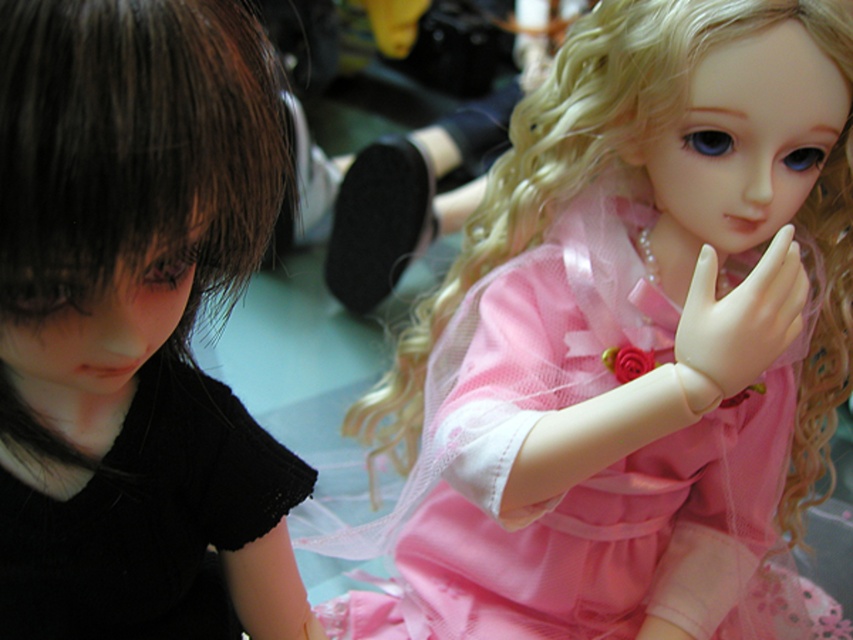
You are a toy organizer trying to arrange the matte pink fabric doll at center and the white matte hand at center on a shelf. The shelf has a width of 15 centimeters. Can both items fit side by side on the shelf without overlapping?

The matte pink fabric doll at center and white matte hand at center are 16.14 centimeters apart from each other. Since the shelf is only 15 centimeters wide, they cannot fit side by side without overlapping.

You are organizing a doll display and need to ensure the matte pink fabric doll at center and the matte black doll at left can fit side by side on a shelf that is 50 cm wide. Given their widths, will they both fit?

The matte pink fabric doll at center is wider than the matte black doll at left. Therefore, if their combined widths exceed 50 cm, they won